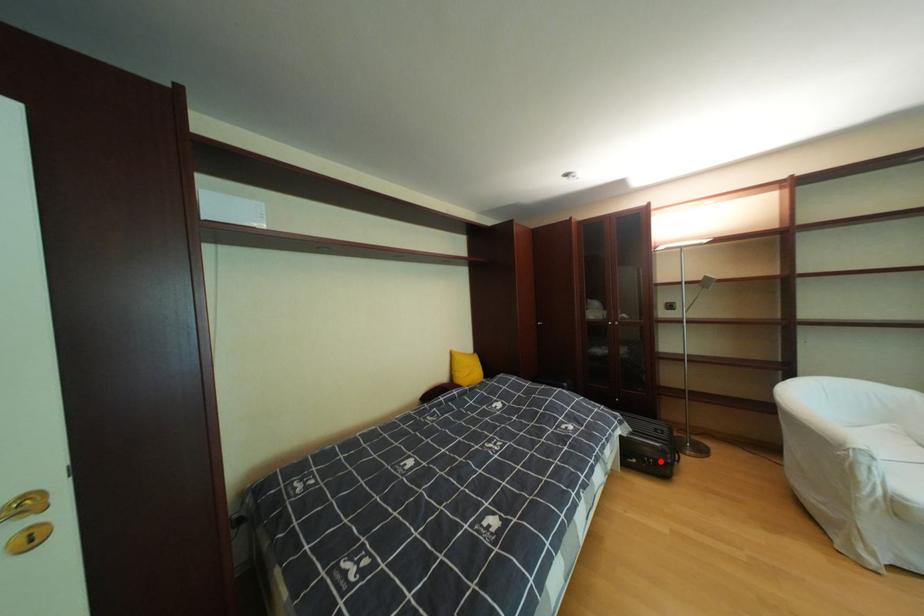
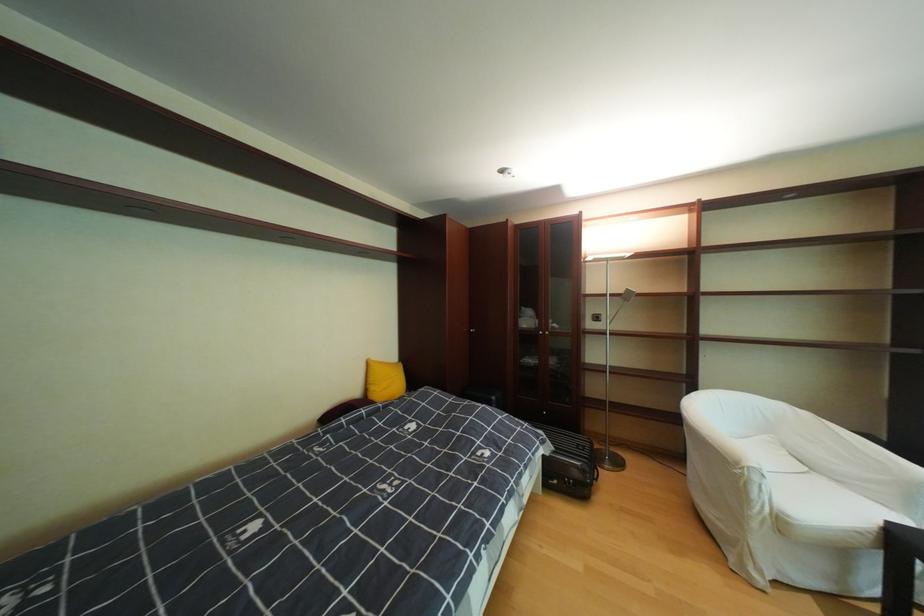
Question: I am providing you with two images of the same scene from different viewpoints. In image1, a red point is highlighted. Considering the same 3D point in image2, which of the following is correct?

Choices:
 (A) It is closer
 (B) It is farther

Answer: (B)